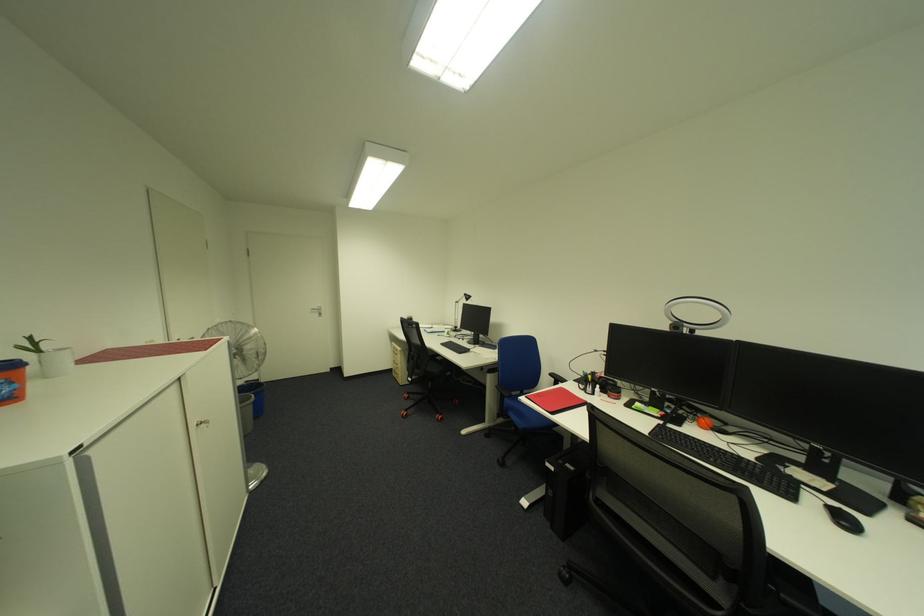
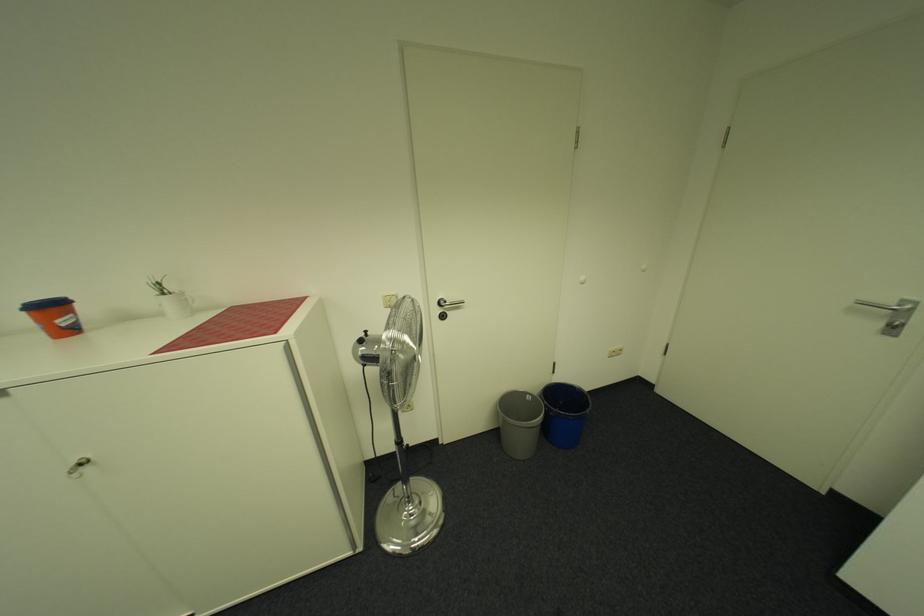
The point at (325, 309) is marked in the first image. Where is the corresponding point in the second image?

(898, 302)